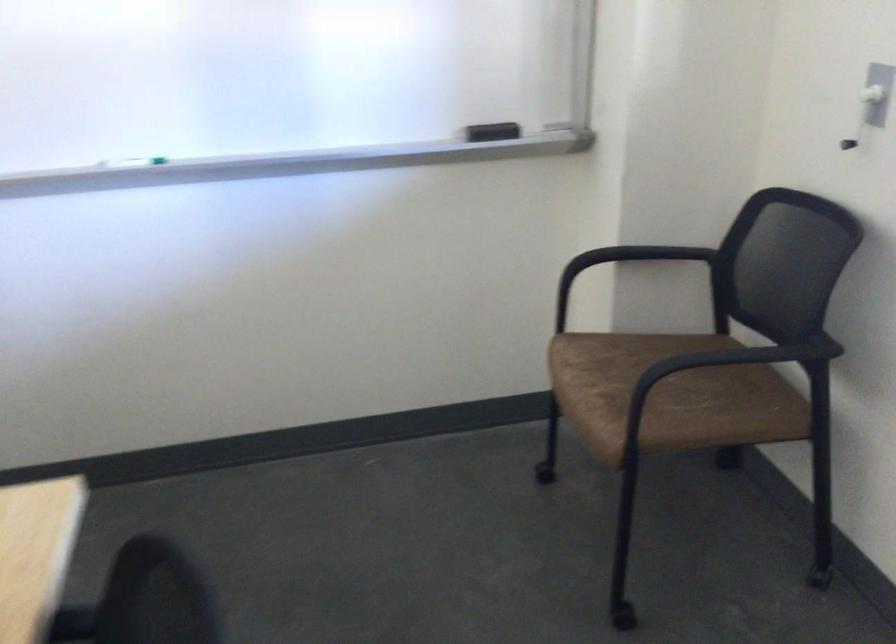
Question: The first image is from the beginning of the video and the second image is from the end. How did the camera likely rotate when shooting the video?

Choices:
 (A) Left
 (B) Right
 (C) Up
 (D) Down

Answer: (B)